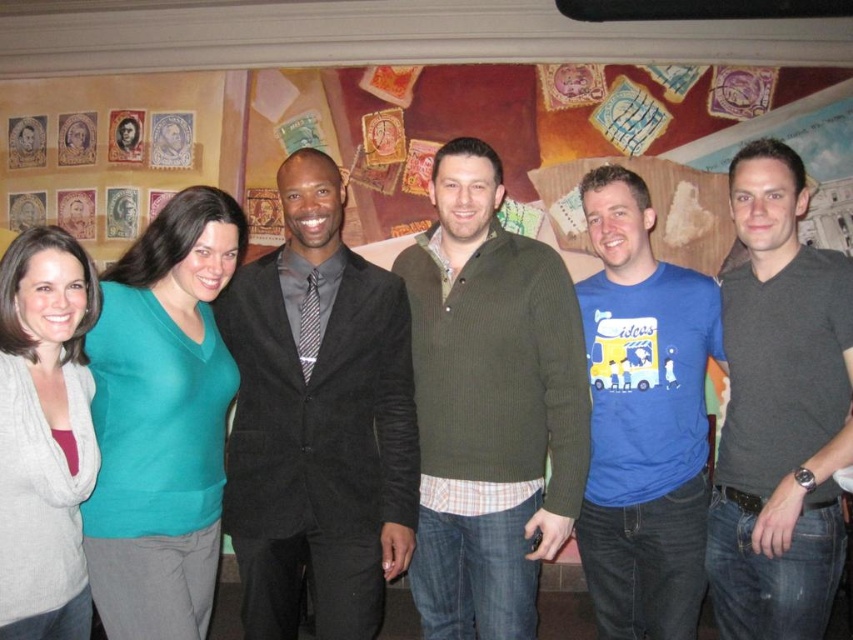
Who is lower down, olive-green sweater at center or gray knit cardigan at left?

gray knit cardigan at left is lower down.

Is point (563, 292) farther from viewer compared to point (1, 390)?

Yes, point (563, 292) is farther from viewer.

Locate an element on the screen. olive-green sweater at center is located at coordinates (489, 404).

This screenshot has width=853, height=640. In order to click on olive-green sweater at center in this screenshot , I will do `click(489, 404)`.

Is suede black suit at center positioned before gray knit cardigan at left?

No, it is not.

Between point (222, 512) and point (27, 548), which one is positioned in front?

Point (27, 548) is in front.

Which is behind, point (294, 572) or point (26, 403)?

Positioned behind is point (294, 572).

I want to click on suede black suit at center, so click(318, 420).

Can you confirm if olive-green sweater at center is positioned above blue cotton t-shirt at center?

Indeed, olive-green sweater at center is positioned over blue cotton t-shirt at center.

Between point (471, 342) and point (683, 284), which one is positioned in front?

Point (471, 342)

The image size is (853, 640). What are the coordinates of `olive-green sweater at center` in the screenshot? It's located at click(489, 404).